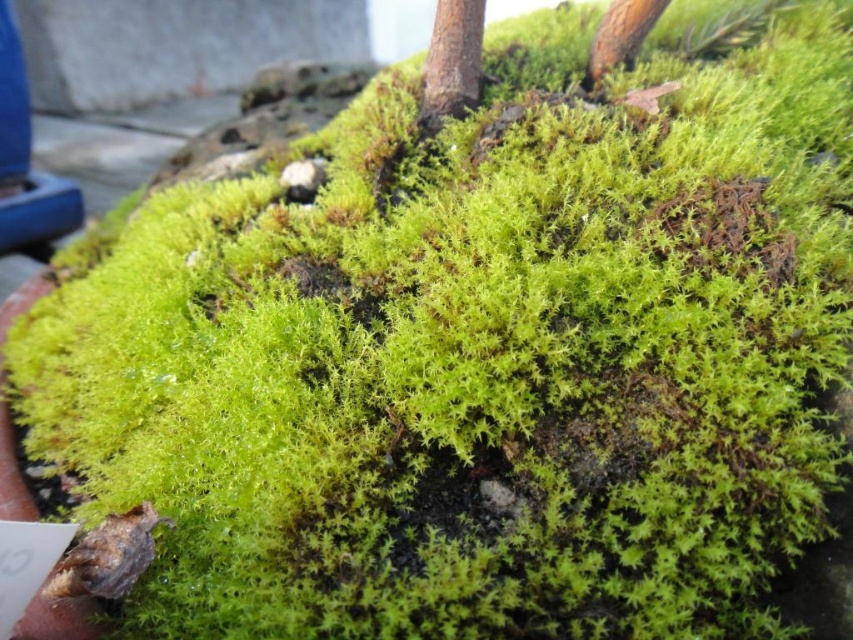
Question: Is the position of smooth brown tree trunk at upper center more distant than that of brown rough wood at upper right?

Choices:
 (A) yes
 (B) no

Answer: (B)

Question: Does smooth brown tree trunk at upper center lie behind brown rough wood at upper right?

Choices:
 (A) no
 (B) yes

Answer: (A)

Question: Which point appears closest to the camera in this image?

Choices:
 (A) (444, 51)
 (B) (627, 26)

Answer: (A)

Question: Considering the relative positions of smooth brown tree trunk at upper center and brown rough wood at upper right in the image provided, where is smooth brown tree trunk at upper center located with respect to brown rough wood at upper right?

Choices:
 (A) right
 (B) left

Answer: (B)